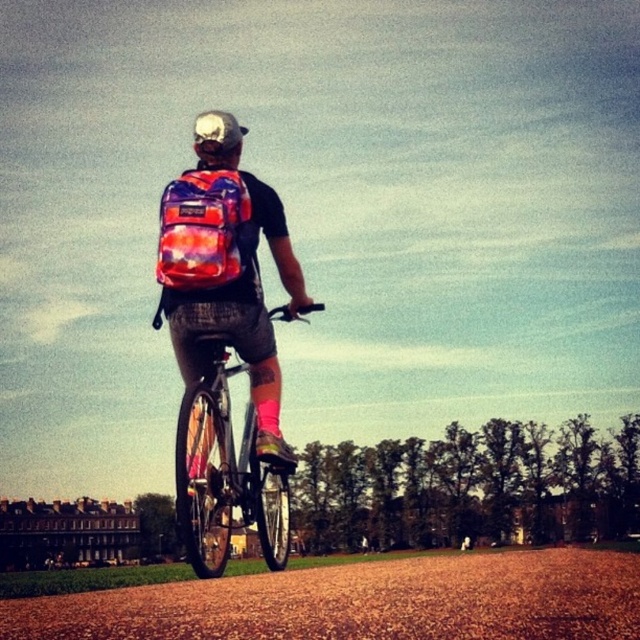
Question: Estimate the real-world distances between objects in this image. Which object is farther from the white matte bicycle helmet at upper center?

Choices:
 (A) shiny metallic bicycle at center
 (B) multicolored fabric backpack at center
 (C) shiny multicolored backpack at center

Answer: (C)

Question: Is shiny multicolored backpack at center above white matte bicycle helmet at upper center?

Choices:
 (A) no
 (B) yes

Answer: (A)

Question: Can you confirm if multicolored fabric backpack at center is positioned to the left of shiny metallic bicycle at center?

Choices:
 (A) yes
 (B) no

Answer: (A)

Question: Which object is the farthest from the white matte bicycle helmet at upper center?

Choices:
 (A) brown gravel path at center
 (B) multicolored fabric backpack at center
 (C) shiny metallic bicycle at center
 (D) shiny multicolored backpack at center

Answer: (D)

Question: Can you confirm if shiny multicolored backpack at center is bigger than white matte bicycle helmet at upper center?

Choices:
 (A) yes
 (B) no

Answer: (B)

Question: Which of the following is the closest to the observer?

Choices:
 (A) (236, 276)
 (B) (45, 600)
 (C) (216, 525)

Answer: (B)